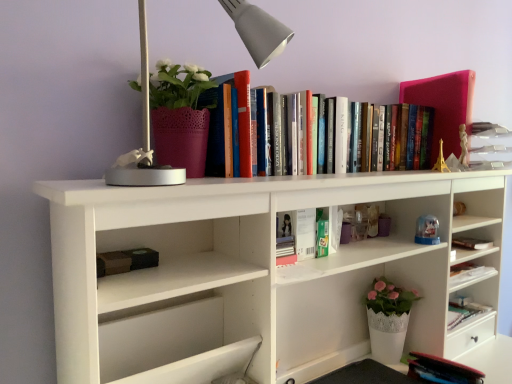
Where is `metallic gray table lamp at upper left`? The width and height of the screenshot is (512, 384). metallic gray table lamp at upper left is located at coordinates (258, 30).

Locate an element on the screen. The height and width of the screenshot is (384, 512). hardcover books at upper center, acting as the 3th book starting from the bottom is located at coordinates (404, 141).

I want to click on metallic gray table lamp at upper left, so click(258, 30).

Is green matte book at center, marked as the second book in a bottom-to-top arrangement, facing away from hardcover books at upper center, acting as the 3th book starting from the bottom?

That's not correct — green matte book at center, marked as the second book in a bottom-to-top arrangement, is not looking away from hardcover books at upper center, acting as the 3th book starting from the bottom.

Is green matte book at center, marked as the second book in a bottom-to-top arrangement, not inside hardcover books at upper center, acting as the 3th book starting from the bottom?

That's correct, green matte book at center, marked as the second book in a bottom-to-top arrangement, is outside of hardcover books at upper center, acting as the 3th book starting from the bottom.

Considering the sizes of green matte book at center, which appears as the 2th book when viewed from the top, and hardcover books at upper center, marked as the first book in a top-to-bottom arrangement, in the image, is green matte book at center, which appears as the 2th book when viewed from the top, taller or shorter than hardcover books at upper center, marked as the first book in a top-to-bottom arrangement,?

Considering their sizes, green matte book at center, which appears as the 2th book when viewed from the top, has less height than hardcover books at upper center, marked as the first book in a top-to-bottom arrangement.

Is green matte book at center, which appears as the 2th book when viewed from the top, to the left of hardcover books at upper center, marked as the first book in a top-to-bottom arrangement, from the viewer's perspective?

Correct, you'll find green matte book at center, which appears as the 2th book when viewed from the top, to the left of hardcover books at upper center, marked as the first book in a top-to-bottom arrangement.

From the image's perspective, which one is positioned lower, matte pink book at upper right or metallic gray table lamp at upper left?

metallic gray table lamp at upper left.

Which point is more forward, (456, 151) or (280, 48)?

The point (280, 48) is in front.

Is matte pink book at upper right situated inside metallic gray table lamp at upper left or outside?

matte pink book at upper right is not enclosed by metallic gray table lamp at upper left.

Based on the photo, between matte pink book at upper right and metallic gray table lamp at upper left, which one has larger width?

Wider between the two is matte pink book at upper right.

Is hardcover books at upper center, acting as the 3th book starting from the bottom, positioned with its back to green matte book at center, marked as the second book in a bottom-to-top arrangement?

No, hardcover books at upper center, acting as the 3th book starting from the bottom,'s orientation is not away from green matte book at center, marked as the second book in a bottom-to-top arrangement.

Is point (406, 132) positioned behind point (291, 230)?

Yes, it is.

Would you say hardcover books at upper center, acting as the 3th book starting from the bottom, is inside or outside green matte book at center, marked as the second book in a bottom-to-top arrangement?

hardcover books at upper center, acting as the 3th book starting from the bottom, lies outside green matte book at center, marked as the second book in a bottom-to-top arrangement.

Considering the positions of objects hardcover books at upper center, marked as the first book in a top-to-bottom arrangement, and green matte book at center, marked as the second book in a bottom-to-top arrangement, in the image provided, who is behind, hardcover books at upper center, marked as the first book in a top-to-bottom arrangement, or green matte book at center, marked as the second book in a bottom-to-top arrangement,?

Positioned behind is green matte book at center, marked as the second book in a bottom-to-top arrangement.

Looking at this image, between hardcover books at upper center, marked as the first book in a top-to-bottom arrangement, and hardcover book at lower right, which is counted as the 1th book, starting from the bottom, which one has less height?

With less height is hardcover book at lower right, which is counted as the 1th book, starting from the bottom.

Considering the relative sizes of hardcover books at upper center, acting as the 3th book starting from the bottom, and hardcover book at lower right, which ranks as the 3th book in top-to-bottom order, in the image provided, is hardcover books at upper center, acting as the 3th book starting from the bottom, smaller than hardcover book at lower right, which ranks as the 3th book in top-to-bottom order,?

No.

Is hardcover book at lower right, which is counted as the 1th book, starting from the bottom, at the back of hardcover books at upper center, acting as the 3th book starting from the bottom?

No, hardcover books at upper center, acting as the 3th book starting from the bottom, is not facing away from hardcover book at lower right, which is counted as the 1th book, starting from the bottom.

Can you confirm if matte pink pot at upper left is shorter than matte pink book at upper right?

Yes.

From a real-world perspective, is matte pink pot at upper left physically located above or below matte pink book at upper right?

matte pink pot at upper left is situated lower than matte pink book at upper right in the real world.

What's the angular difference between matte pink pot at upper left and matte pink book at upper right's facing directions?

The facing directions of matte pink pot at upper left and matte pink book at upper right are 2.79 degrees apart.

From the image's perspective, would you say hardcover book at lower right, which is counted as the 1th book, starting from the bottom, is shown under metallic gray table lamp at upper left?

Yes, from the image's perspective, hardcover book at lower right, which is counted as the 1th book, starting from the bottom, is beneath metallic gray table lamp at upper left.

Looking at this image, is there a large distance between hardcover book at lower right, which is counted as the 1th book, starting from the bottom, and metallic gray table lamp at upper left?

hardcover book at lower right, which is counted as the 1th book, starting from the bottom, is far away from metallic gray table lamp at upper left.

From the picture: Is hardcover book at lower right, which is counted as the 1th book, starting from the bottom, not within metallic gray table lamp at upper left?

Indeed, hardcover book at lower right, which is counted as the 1th book, starting from the bottom, is completely outside metallic gray table lamp at upper left.

Considering the relative sizes of hardcover book at lower right, which is counted as the 1th book, starting from the bottom, and metallic gray table lamp at upper left in the image provided, is hardcover book at lower right, which is counted as the 1th book, starting from the bottom, wider than metallic gray table lamp at upper left?

Incorrect, the width of hardcover book at lower right, which is counted as the 1th book, starting from the bottom, does not surpass that of metallic gray table lamp at upper left.

What's the angular difference between metallic gray table lamp at upper left and hardcover books at upper center, marked as the first book in a top-to-bottom arrangement,'s facing directions?

The angle between the facing direction of metallic gray table lamp at upper left and the facing direction of hardcover books at upper center, marked as the first book in a top-to-bottom arrangement, is 1.26 degrees.

Do you think metallic gray table lamp at upper left is within hardcover books at upper center, acting as the 3th book starting from the bottom, or outside of it?

The correct answer is: outside.

Is metallic gray table lamp at upper left directly adjacent to hardcover books at upper center, marked as the first book in a top-to-bottom arrangement?

metallic gray table lamp at upper left and hardcover books at upper center, marked as the first book in a top-to-bottom arrangement, are clearly separated.

Which is closer, (131,183) or (407,138)?

Point (131,183) appears to be closer to the viewer than point (407,138).

From a real-world perspective, starting from the hardcover books at upper center, acting as the 3th book starting from the bottom, which book is the 1st one below it? Please provide its 2D coordinates.

[(301, 230)]

This screenshot has height=384, width=512. In order to click on table lamp in front of the matte pink book at upper right in this screenshot , I will do `click(258, 30)`.

Considering their positions, is matte pink pot at upper left positioned closer to matte pink book at upper right than hardcover books at upper center, acting as the 3th book starting from the bottom?

Based on the image, hardcover books at upper center, acting as the 3th book starting from the bottom, appears to be nearer to matte pink book at upper right.

Which object lies further to the anchor point hardcover book at lower right, which ranks as the 3th book in top-to-bottom order, green matte book at center, marked as the second book in a bottom-to-top arrangement, or matte pink pot at upper left?

matte pink pot at upper left is further to hardcover book at lower right, which ranks as the 3th book in top-to-bottom order.

When comparing their distances from matte pink pot at upper left, does metallic gray table lamp at upper left or hardcover book at lower right, which ranks as the 3th book in top-to-bottom order, seem further?

The object further to matte pink pot at upper left is hardcover book at lower right, which ranks as the 3th book in top-to-bottom order.

Based on their spatial positions, is matte pink book at upper right or metallic gray table lamp at upper left further from matte pink pot at upper left?

Among the two, matte pink book at upper right is located further to matte pink pot at upper left.

When comparing their distances from metallic gray table lamp at upper left, does green matte book at center, marked as the second book in a bottom-to-top arrangement, or matte pink book at upper right seem closer?

green matte book at center, marked as the second book in a bottom-to-top arrangement, is positioned closer to the anchor metallic gray table lamp at upper left.

Looking at the image, which one is located closer to hardcover book at lower right, which is counted as the 1th book, starting from the bottom, hardcover books at upper center, marked as the first book in a top-to-bottom arrangement, or metallic gray table lamp at upper left?

hardcover books at upper center, marked as the first book in a top-to-bottom arrangement, lies closer to hardcover book at lower right, which is counted as the 1th book, starting from the bottom, than the other object.

From the image, which object appears to be nearer to green matte book at center, which appears as the 2th book when viewed from the top, hardcover book at lower right, which is counted as the 1th book, starting from the bottom, or metallic gray table lamp at upper left?

metallic gray table lamp at upper left is closer to green matte book at center, which appears as the 2th book when viewed from the top.

Considering their positions, is metallic gray table lamp at upper left positioned further to hardcover book at lower right, which is counted as the 1th book, starting from the bottom, than green matte book at center, which appears as the 2th book when viewed from the top?

metallic gray table lamp at upper left is further to hardcover book at lower right, which is counted as the 1th book, starting from the bottom.

The height and width of the screenshot is (384, 512). In order to click on floral arrangement between metallic gray table lamp at upper left and hardcover book at lower right, which ranks as the 3th book in top-to-bottom order, in the vertical direction in this screenshot , I will do `click(180, 115)`.

Locate an element on the screen. book between metallic gray table lamp at upper left and green matte book at center, marked as the second book in a bottom-to-top arrangement, along the z-axis is located at coordinates 404,141.

The width and height of the screenshot is (512, 384). What are the coordinates of `floral arrangement positioned between metallic gray table lamp at upper left and green matte book at center, which appears as the 2th book when viewed from the top, from near to far` in the screenshot? It's located at (180, 115).

This screenshot has width=512, height=384. I want to click on floral arrangement between hardcover books at upper center, acting as the 3th book starting from the bottom, and hardcover book at lower right, which ranks as the 3th book in top-to-bottom order, in the vertical direction, so click(x=180, y=115).